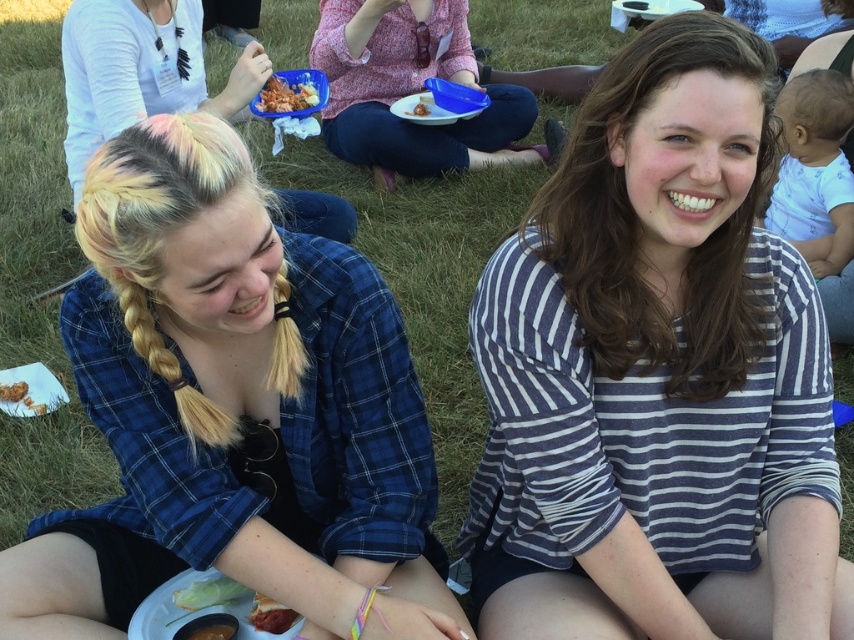
Question: Which point is closer to the camera?

Choices:
 (A) (132, 40)
 (B) (540, 481)

Answer: (B)

Question: Does matte pink shirt at upper center appear on the right side of blonde hair at upper left?

Choices:
 (A) no
 (B) yes

Answer: (B)

Question: Does blue plaid shirt at left come in front of shiny red sauce at lower left?

Choices:
 (A) no
 (B) yes

Answer: (B)

Question: Which point appears closest to the camera in this image?

Choices:
 (A) (278, 115)
 (B) (427, 115)
 (C) (203, 596)

Answer: (C)

Question: Does shiny red sauce at lower left lie in front of matte plastic fork at center?

Choices:
 (A) no
 (B) yes

Answer: (B)

Question: Which point appears farthest from the camera in this image?

Choices:
 (A) (227, 589)
 (B) (410, 54)
 (C) (26, 401)

Answer: (B)